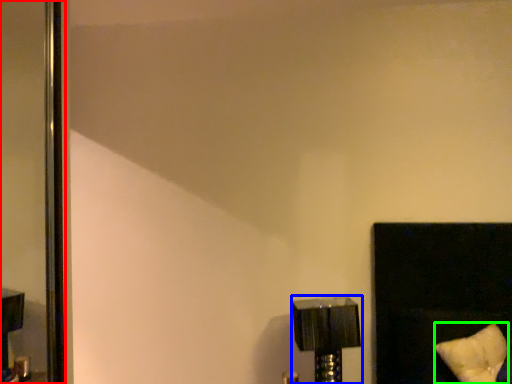
Question: Which object is the closest to the screen door (highlighted by a red box)? Choose among these: lamp (highlighted by a blue box) or pillow (highlighted by a green box).

Choices:
 (A) lamp
 (B) pillow

Answer: (A)